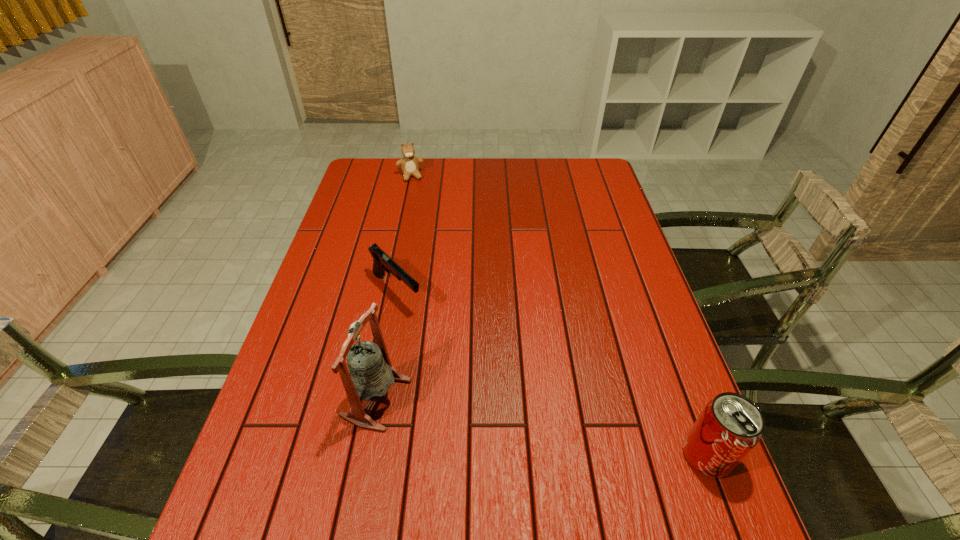
Identify the location of vacant space on the desktop that is between the tallest object and the rightmost object and is positioned on the front-facing side of the farthest object. The height and width of the screenshot is (540, 960). (486, 417).

Locate an element on the screen. free spot on the desktop that is between the bell and the third shortest object and is positioned at the aiming end of the second farthest object is located at coordinates (533, 426).